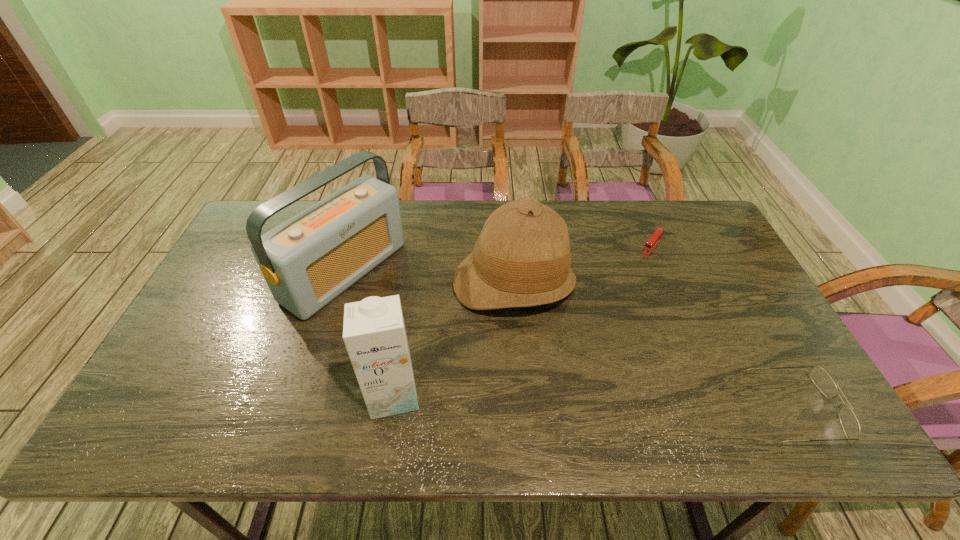
The width and height of the screenshot is (960, 540). In order to click on spectacles at the near edge in this screenshot , I will do `click(850, 424)`.

The height and width of the screenshot is (540, 960). I want to click on object at the right edge, so click(850, 424).

Find the location of a particular element. The height and width of the screenshot is (540, 960). object that is at the near right corner is located at coordinates (850, 424).

I want to click on blank space at the far edge of the desktop, so click(423, 222).

Locate an element on the screen. The height and width of the screenshot is (540, 960). free space at the near edge of the desktop is located at coordinates (532, 374).

Where is `blank space at the left edge of the desktop`? This screenshot has width=960, height=540. blank space at the left edge of the desktop is located at coordinates (239, 271).

Find the location of a particular element. The height and width of the screenshot is (540, 960). free space at the right edge of the desktop is located at coordinates (774, 338).

Identify the location of blank area at the far left corner. The image size is (960, 540). (239, 241).

The image size is (960, 540). In order to click on vacant region at the far right corner of the desktop in this screenshot , I will do `click(712, 239)`.

Identify the location of vacant space at the near right corner. Image resolution: width=960 pixels, height=540 pixels. (752, 402).